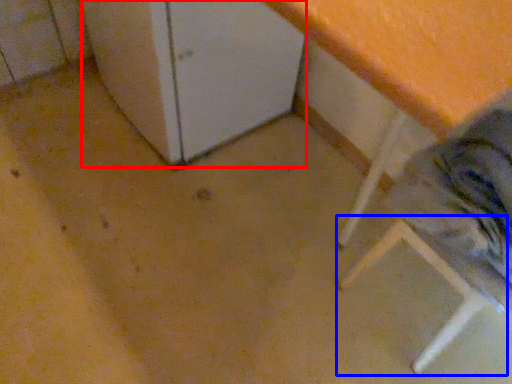
Question: Which of the following is the closest to the observer, leftover (highlighted by a red box) or step stool (highlighted by a blue box)?

Choices:
 (A) leftover
 (B) step stool

Answer: (B)